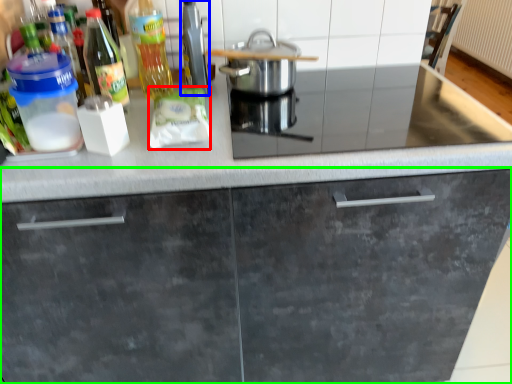
Question: Which object is the farthest from food (highlighted by a red box)? Choose among these: appliance (highlighted by a blue box) or cabinetry (highlighted by a green box).

Choices:
 (A) appliance
 (B) cabinetry

Answer: (B)